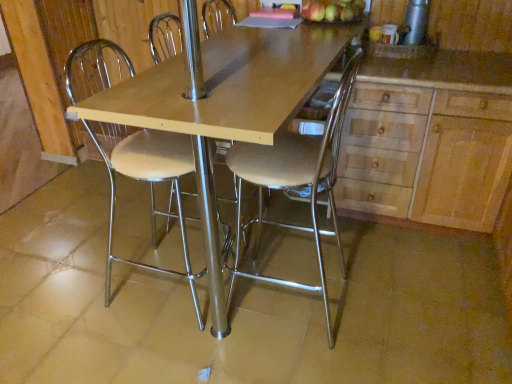
You are a GUI agent. You are given a task and a screenshot of the screen. Output one action in this format:
    pyautogui.click(x=<x>, y=<y>)
    Task: Click on the free region on the left part of wooden table at center
    This screenshot has height=384, width=512.
    Given the screenshot: What is the action you would take?
    pyautogui.click(x=99, y=243)